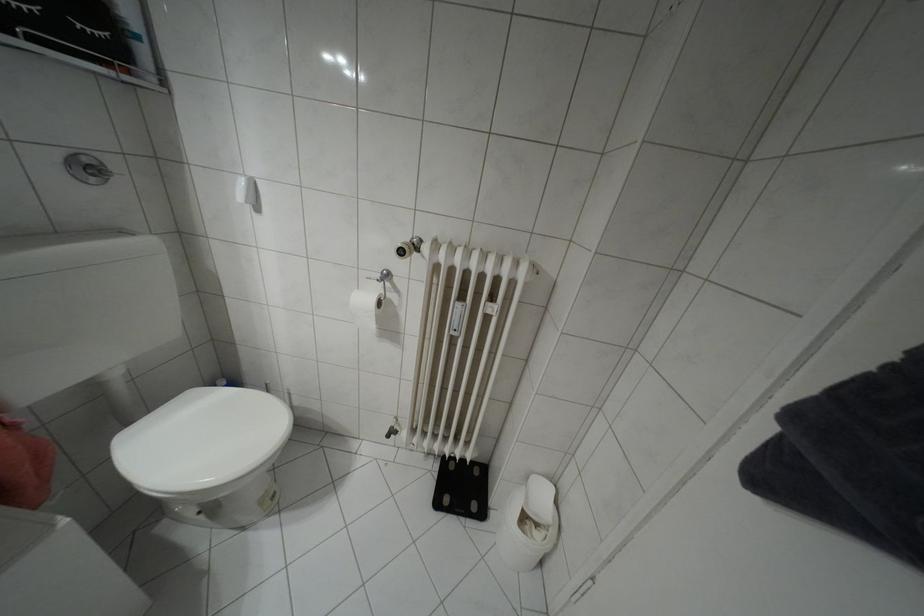
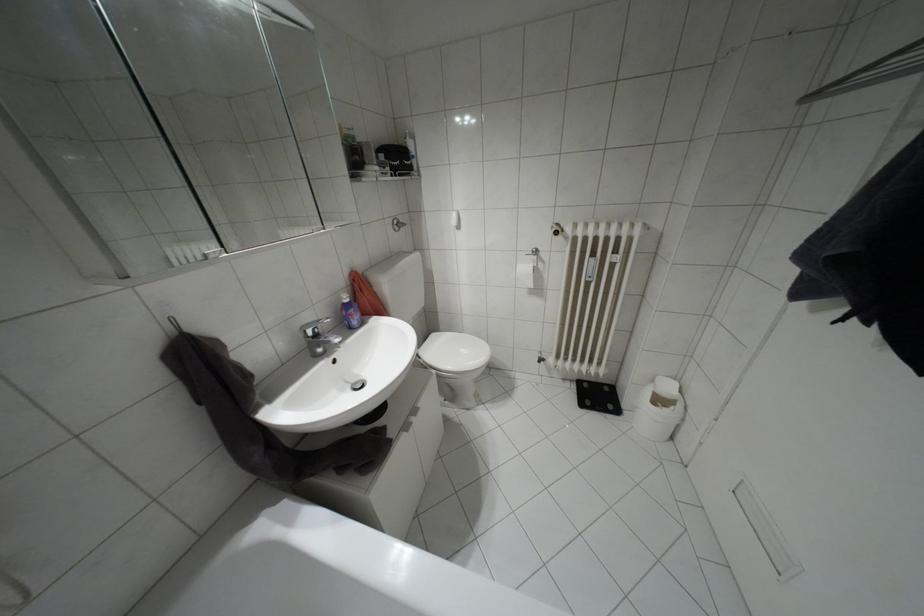
Locate, in the second image, the point that corresponds to the point at 92,179 in the first image.

(395, 229)